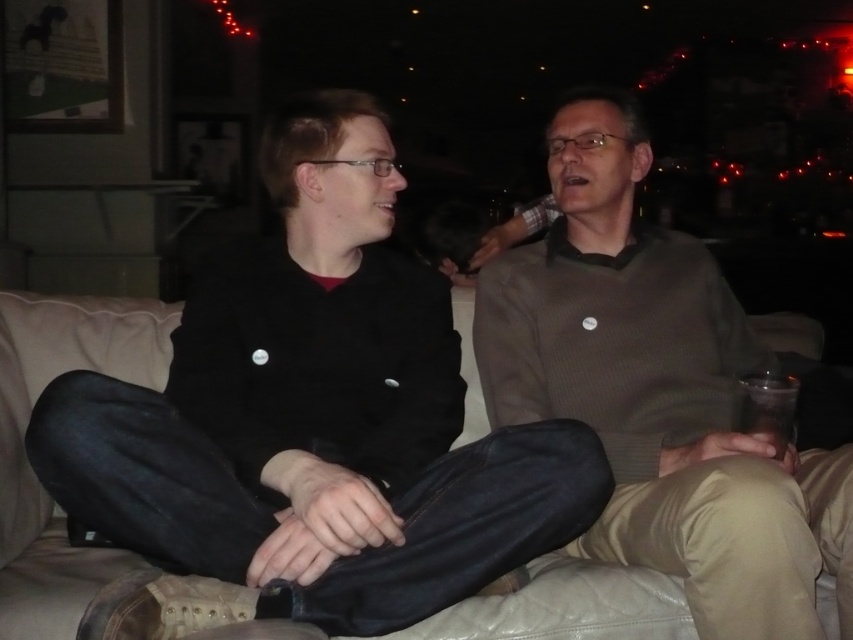
Question: Among these points, which one is nearest to the camera?

Choices:
 (A) (53, 394)
 (B) (751, 403)
 (C) (726, 550)

Answer: (C)

Question: Is black matte jacket at center to the left of matte brown sweater at center from the viewer's perspective?

Choices:
 (A) no
 (B) yes

Answer: (B)

Question: Among these objects, which one is nearest to the camera?

Choices:
 (A) transparent plastic cup at lower right
 (B) black matte jacket at center

Answer: (B)

Question: Does black matte jacket at center have a larger size compared to transparent plastic cup at lower right?

Choices:
 (A) yes
 (B) no

Answer: (A)

Question: Does matte brown sweater at center appear under transparent plastic cup at lower right?

Choices:
 (A) no
 (B) yes

Answer: (A)

Question: Which object is closer to the camera taking this photo?

Choices:
 (A) beige leather couch at center
 (B) black matte jacket at center
 (C) matte brown sweater at center
 (D) transparent plastic cup at lower right

Answer: (B)